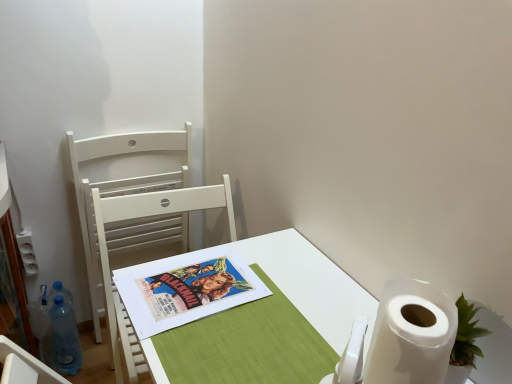
The width and height of the screenshot is (512, 384). What are the coordinates of `vacant area located to the right-hand side of colorful paper poster at center` in the screenshot? It's located at (293, 298).